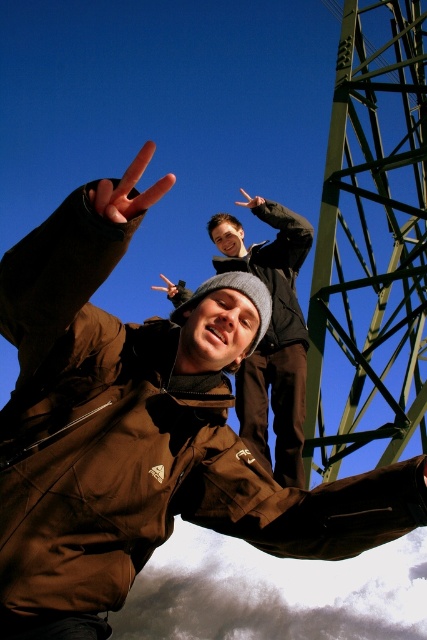
You are a photographer trying to capture both the green metallic tower at upper right and the brown fabric hand at upper center in a single frame. Based on their sizes in the image, which object would appear larger in the photo?

The green metallic tower at upper right appears much larger in the photo because it is described as much taller than the brown fabric hand at upper center.

You are a photographer trying to capture a group photo of the two people in the scene. The minimum distance required between subjects for the camera to focus properly is 30 inches. Based on the spacing between the brown soft jacket at center and the dark brown jacket at upper center, will the camera be able to focus on both subjects simultaneously?

The brown soft jacket at center and the dark brown jacket at upper center are 27.59 inches apart from each other. Since this distance is less than the required 30 inches, the camera may struggle to focus on both subjects simultaneously.